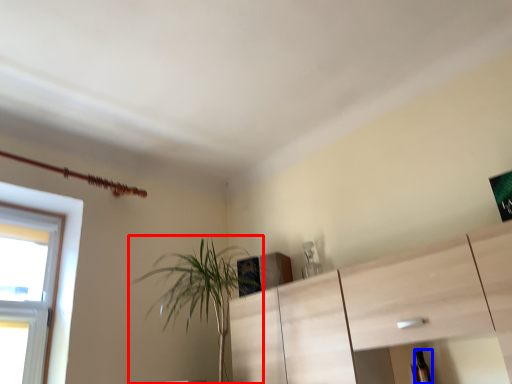
Question: Among these objects, which one is farthest to the camera, houseplant (highlighted by a red box) or bottle (highlighted by a blue box)?

Choices:
 (A) houseplant
 (B) bottle

Answer: (B)